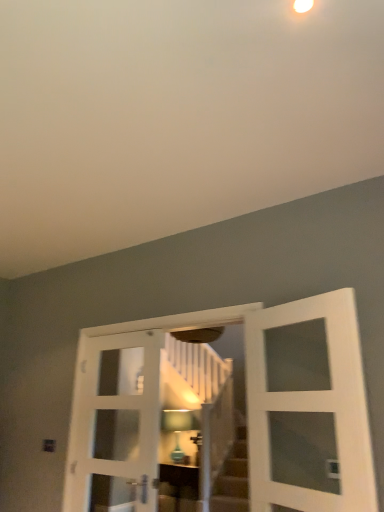
Question: Would you say white glass door at center, marked as the 3th door in a right-to-left arrangement, is to the left or to the right of matte brown cabinet at center in the picture?

Choices:
 (A) right
 (B) left

Answer: (B)

Question: Is white glass door at center, which appears as the 1th door when viewed from the left, inside or outside of matte brown cabinet at center?

Choices:
 (A) outside
 (B) inside

Answer: (A)

Question: Based on their relative distances, which object is nearer to the matte brown cabinet at center?

Choices:
 (A) white glass door at center, which appears as the 1th door when viewed from the right
 (B) matte glass lampshade at center
 (C) white glass door at center, which appears as the 1th door when viewed from the left
 (D) white wooden door at center, positioned as the second door in left-to-right order

Answer: (B)

Question: Based on their relative distances, which object is nearer to the white glass door at center, which appears as the 1th door when viewed from the right?

Choices:
 (A) white wooden door at center, positioned as the second door in left-to-right order
 (B) matte glass lampshade at center
 (C) white glass door at center, which appears as the 1th door when viewed from the left
 (D) matte brown cabinet at center

Answer: (A)